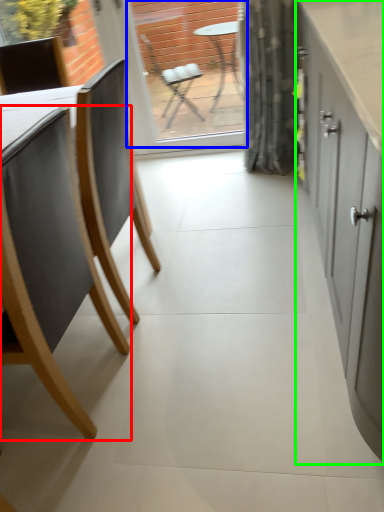
Question: Which object is the farthest from chair (highlighted by a red box)? Choose among these: window screen (highlighted by a blue box) or cabinetry (highlighted by a green box).

Choices:
 (A) window screen
 (B) cabinetry

Answer: (A)